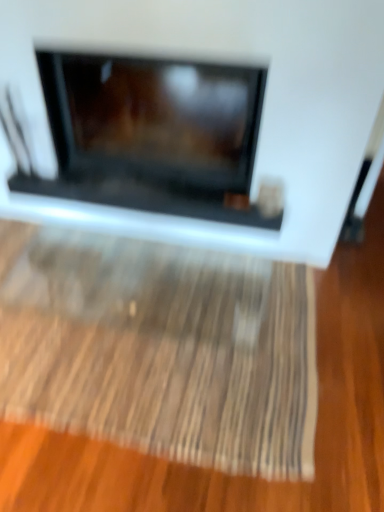
You are a GUI agent. You are given a task and a screenshot of the screen. Output one action in this format:
    pyautogui.click(x=<x>, y=<y>)
    Task: Click on the matte black fireplace at center
    
    Given the screenshot: What is the action you would take?
    pyautogui.click(x=263, y=105)

Image resolution: width=384 pixels, height=512 pixels. Describe the element at coordinates (263, 105) in the screenshot. I see `matte black fireplace at center` at that location.

At what (x,y) coordinates should I click in order to perform the action: click on wooden textured mat at center. Please return your answer as a coordinate pair (x, y). The width and height of the screenshot is (384, 512). Looking at the image, I should click on (161, 349).

This screenshot has width=384, height=512. What do you see at coordinates (161, 349) in the screenshot?
I see `wooden textured mat at center` at bounding box center [161, 349].

I want to click on matte black fireplace at center, so click(x=263, y=105).

Which object is positioned more to the left, matte black fireplace at center or wooden textured mat at center?

From the viewer's perspective, wooden textured mat at center appears more on the left side.

Which is behind, matte black fireplace at center or wooden textured mat at center?

wooden textured mat at center.

Which is less distant, (x=289, y=218) or (x=103, y=437)?

Point (x=289, y=218).

From the image's perspective, which one is positioned higher, matte black fireplace at center or wooden textured mat at center?

matte black fireplace at center.

From a real-world perspective, is matte black fireplace at center physically located above or below wooden textured mat at center?

From a real-world perspective, matte black fireplace at center is physically above wooden textured mat at center.

Which of these two, matte black fireplace at center or wooden textured mat at center, is wider?

wooden textured mat at center is wider.

Between matte black fireplace at center and wooden textured mat at center, which one has more height?

Standing taller between the two is matte black fireplace at center.

Which of these two, matte black fireplace at center or wooden textured mat at center, is smaller?

wooden textured mat at center is smaller.

In the scene shown: Would you say matte black fireplace at center contains wooden textured mat at center?

No, wooden textured mat at center is not surrounded by matte black fireplace at center.

Is matte black fireplace at center directly adjacent to wooden textured mat at center?

They are not placed beside each other.

Could you tell me if matte black fireplace at center is facing wooden textured mat at center?

Yes, matte black fireplace at center is facing wooden textured mat at center.

The image size is (384, 512). I want to click on mat beneath the matte black fireplace at center (from a real-world perspective), so click(x=161, y=349).

Which is more to the left, wooden textured mat at center or matte black fireplace at center?

Positioned to the left is wooden textured mat at center.

Considering the positions of objects wooden textured mat at center and matte black fireplace at center in the image provided, who is in front, wooden textured mat at center or matte black fireplace at center?

matte black fireplace at center is closer to the camera.

Is point (221, 371) positioned in front of point (165, 51)?

No, it is behind (165, 51).

From the image's perspective, is wooden textured mat at center located above or below matte black fireplace at center?

wooden textured mat at center is situated lower than matte black fireplace at center in the image.

From a real-world perspective, does wooden textured mat at center sit lower than matte black fireplace at center?

Correct, in the physical world, wooden textured mat at center is lower than matte black fireplace at center.

Which object is thinner, wooden textured mat at center or matte black fireplace at center?

matte black fireplace at center.

Which of these two, wooden textured mat at center or matte black fireplace at center, stands taller?

Standing taller between the two is matte black fireplace at center.

Based on the photo, considering the sizes of wooden textured mat at center and matte black fireplace at center in the image, is wooden textured mat at center bigger or smaller than matte black fireplace at center?

In the image, wooden textured mat at center appears to be smaller than matte black fireplace at center.

Is wooden textured mat at center situated inside matte black fireplace at center or outside?

wooden textured mat at center is located beyond the bounds of matte black fireplace at center.

Is wooden textured mat at center next to matte black fireplace at center and touching it?

No, wooden textured mat at center is not beside matte black fireplace at center.

Is matte black fireplace at center at the back of wooden textured mat at center?

Absolutely, wooden textured mat at center is directed away from matte black fireplace at center.

The image size is (384, 512). Find the location of `fireplace above the wooden textured mat at center (from the image's perspective)`. fireplace above the wooden textured mat at center (from the image's perspective) is located at coordinates (263, 105).

This screenshot has height=512, width=384. I want to click on fireplace on the right of the wooden textured mat at center, so click(263, 105).

This screenshot has width=384, height=512. In order to click on fireplace that is above the wooden textured mat at center (from the image's perspective) in this screenshot , I will do `click(263, 105)`.